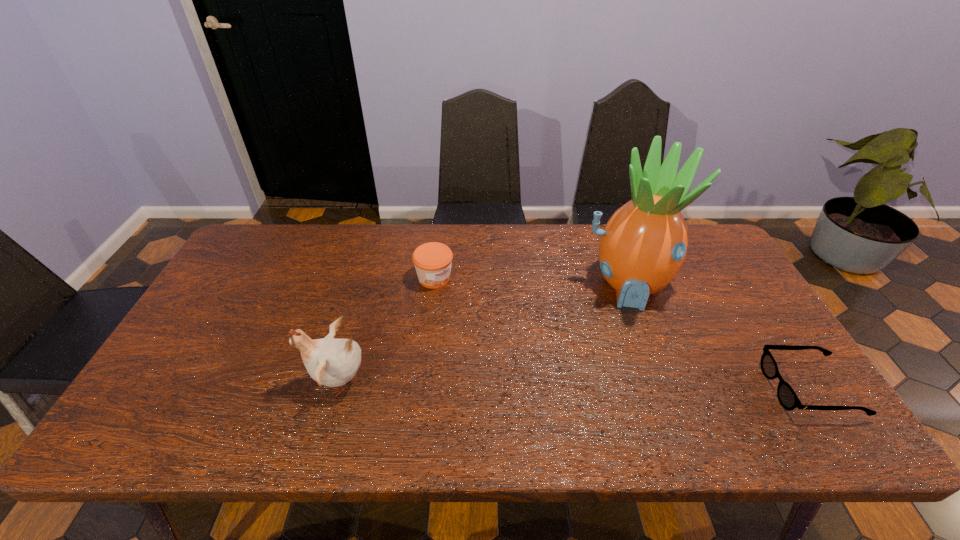
This screenshot has width=960, height=540. Find the location of `vacant space at the far left corner of the desktop`. vacant space at the far left corner of the desktop is located at coordinates (258, 235).

You are a GUI agent. You are given a task and a screenshot of the screen. Output one action in this format:
    pyautogui.click(x=<x>, y=<y>)
    Task: Click on the free space at the far right corner of the desktop
    The height and width of the screenshot is (540, 960).
    Given the screenshot: What is the action you would take?
    pyautogui.click(x=720, y=246)

This screenshot has height=540, width=960. What are the coordinates of `vacant space at the near right corner` in the screenshot? It's located at (801, 380).

Where is `empty space between the second tallest object and the third object from left to right`? The height and width of the screenshot is (540, 960). empty space between the second tallest object and the third object from left to right is located at coordinates (483, 333).

At what (x,y) coordinates should I click in order to perform the action: click on vacant point located between the third object from right to left and the tallest object. Please return your answer as a coordinate pair (x, y). The image size is (960, 540). Looking at the image, I should click on (531, 281).

Image resolution: width=960 pixels, height=540 pixels. Find the location of `free spot between the shortest object and the third tallest object`. free spot between the shortest object and the third tallest object is located at coordinates (622, 333).

The image size is (960, 540). Find the location of `vacant space that's between the pineapple and the leftmost object`. vacant space that's between the pineapple and the leftmost object is located at coordinates (483, 333).

Locate an element on the screen. The image size is (960, 540). vacant area that lies between the spectacles and the bird is located at coordinates (574, 384).

The image size is (960, 540). I want to click on unoccupied position between the pineapple and the jam, so click(531, 281).

Locate an element on the screen. This screenshot has width=960, height=540. empty space between the rightmost object and the leftmost object is located at coordinates (574, 384).